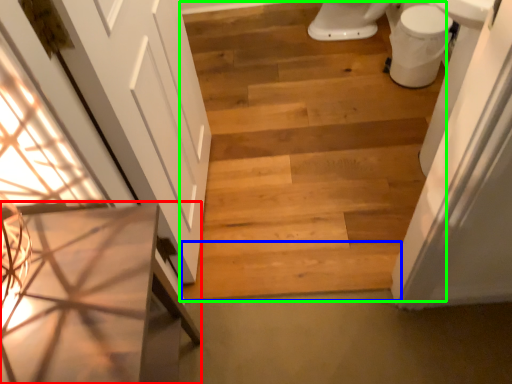
Question: Based on their relative distances, which object is farther from vanity (highlighted by a red box)? Choose from plank (highlighted by a blue box) and stairwell (highlighted by a green box).

Choices:
 (A) plank
 (B) stairwell

Answer: (B)